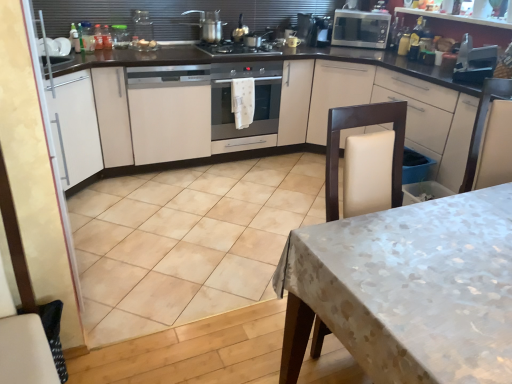
At what (x,y) coordinates should I click in order to perform the action: click on vacant region under metallic microwave at upper right, marked as the 2th appliance in a right-to-left arrangement (from a real-world perspective). Please return your answer as a coordinate pair (x, y). Looking at the image, I should click on (317, 44).